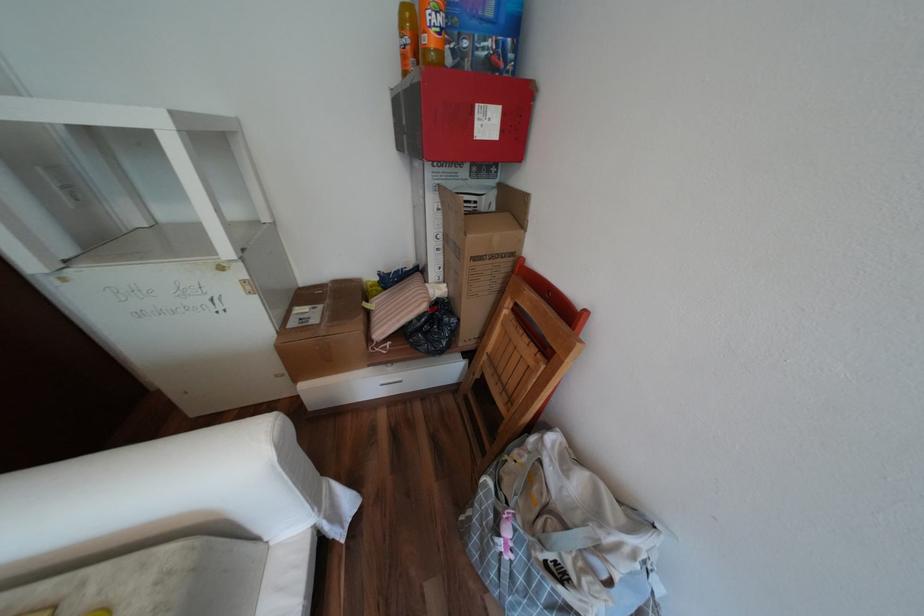
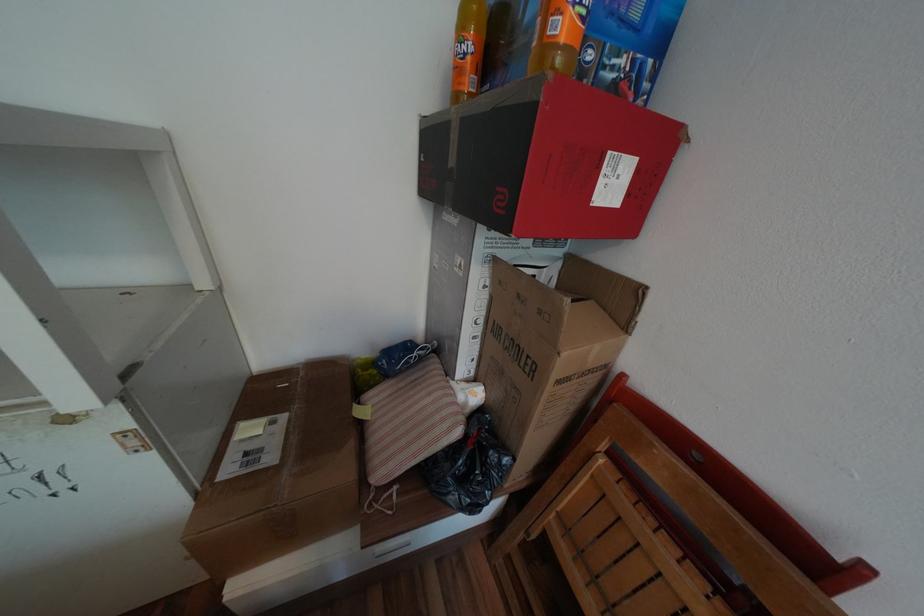
Locate, in the second image, the point that corresponds to [487,123] in the first image.

(611, 182)